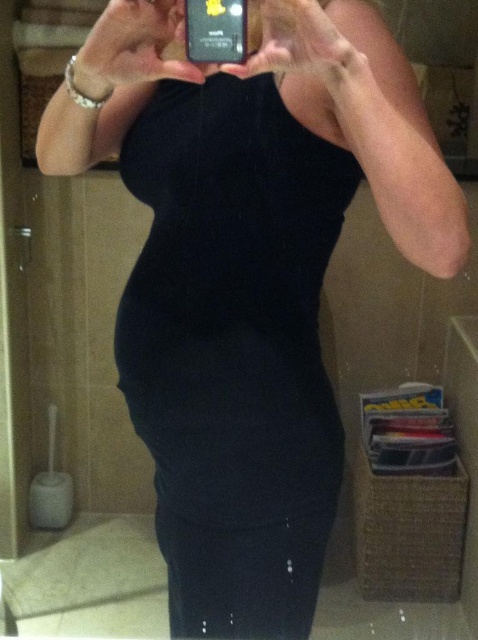
Question: Is black velvet dress at center above black plastic phone at upper center?

Choices:
 (A) no
 (B) yes

Answer: (A)

Question: Among these points, which one is nearest to the camera?

Choices:
 (A) (232, 1)
 (B) (219, 449)

Answer: (A)

Question: Can you confirm if black velvet dress at center is positioned below black plastic phone at upper center?

Choices:
 (A) yes
 (B) no

Answer: (A)

Question: Is black velvet dress at center wider than black plastic phone at upper center?

Choices:
 (A) yes
 (B) no

Answer: (A)